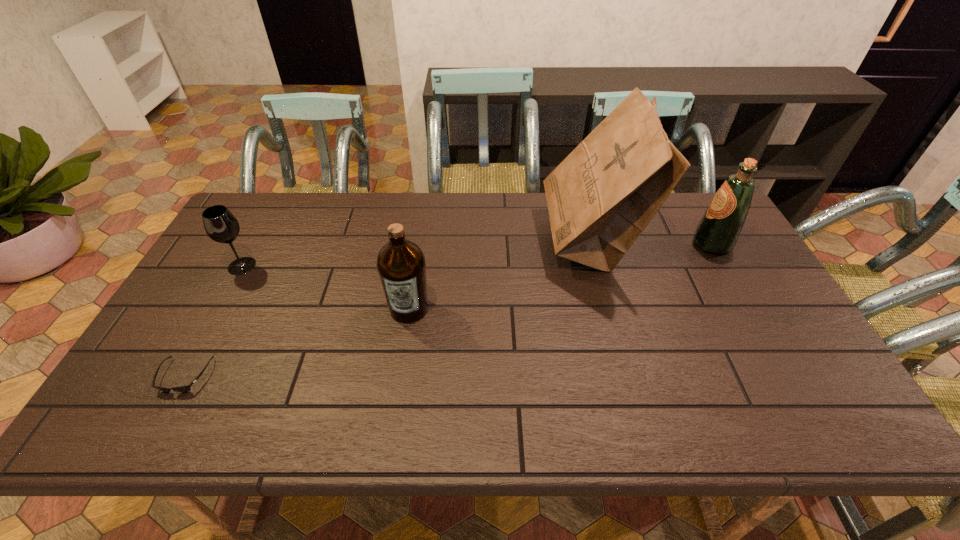
Find the location of a particular element. This screenshot has height=540, width=960. unoccupied position between the third object from left to right and the shortest object is located at coordinates (297, 342).

At what (x,y) coordinates should I click in order to perform the action: click on empty location between the second nearest object and the sunglasses. Please return your answer as a coordinate pair (x, y). Looking at the image, I should click on (297, 342).

The image size is (960, 540). I want to click on free spot between the sunglasses and the farther olive oil, so click(448, 310).

Find the location of a particular element. vacant space that's between the wineglass and the right olive oil is located at coordinates (477, 255).

The height and width of the screenshot is (540, 960). What are the coordinates of `vacant space in between the right olive oil and the wineglass` in the screenshot? It's located at (477, 255).

What are the coordinates of `free space between the second shortest object and the farther olive oil` in the screenshot? It's located at (477, 255).

I want to click on free space between the nearest object and the fourth tallest object, so click(213, 321).

Identify the location of free point between the nearest object and the farther olive oil. (448, 310).

Identify which object is the second closest to the rightmost object. Please provide its 2D coordinates. Your answer should be formatted as a tuple, i.e. [(x, y)], where the tuple contains the x and y coordinates of a point satisfying the conditions above.

[(401, 264)]

Select which object appears as the fourth closest to the tallest object. Please provide its 2D coordinates. Your answer should be formatted as a tuple, i.e. [(x, y)], where the tuple contains the x and y coordinates of a point satisfying the conditions above.

[(182, 388)]